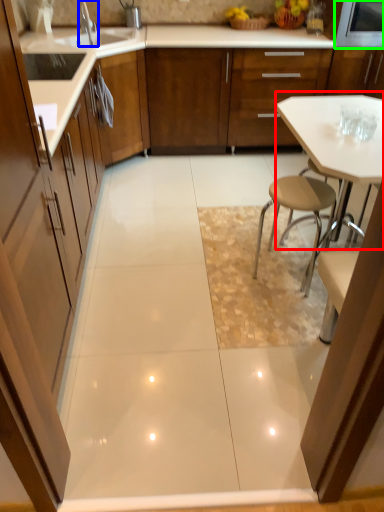
Question: Estimate the real-world distances between objects in this image. Which object is farther from table (highlighted by a red box), tap (highlighted by a blue box) or appliance (highlighted by a green box)?

Choices:
 (A) tap
 (B) appliance

Answer: (A)